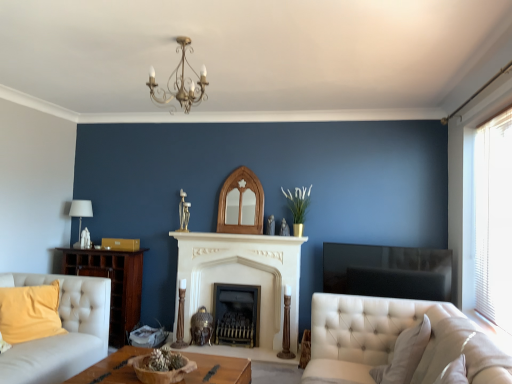
Question: Is white fabric lampshade at left not near gold metallic chandelier at upper center?

Choices:
 (A) yes
 (B) no

Answer: (A)

Question: Considering the relative sizes of white fabric lampshade at left and gold metallic chandelier at upper center in the image provided, is white fabric lampshade at left taller than gold metallic chandelier at upper center?

Choices:
 (A) yes
 (B) no

Answer: (A)

Question: From a real-world perspective, is white fabric lampshade at left positioned under gold metallic chandelier at upper center based on gravity?

Choices:
 (A) no
 (B) yes

Answer: (B)

Question: Is white fabric lampshade at left touching gold metallic chandelier at upper center?

Choices:
 (A) yes
 (B) no

Answer: (B)

Question: Does white fabric lampshade at left have a smaller size compared to gold metallic chandelier at upper center?

Choices:
 (A) no
 (B) yes

Answer: (B)

Question: Can you confirm if white fabric lampshade at left is bigger than gold metallic chandelier at upper center?

Choices:
 (A) no
 (B) yes

Answer: (A)

Question: Is the depth of white marble fireplace at center less than that of gold metallic chandelier at upper center?

Choices:
 (A) yes
 (B) no

Answer: (B)

Question: Can you confirm if white marble fireplace at center is wider than gold metallic chandelier at upper center?

Choices:
 (A) no
 (B) yes

Answer: (A)

Question: Is gold metallic chandelier at upper center located within white marble fireplace at center?

Choices:
 (A) yes
 (B) no

Answer: (B)

Question: From the image's perspective, is white marble fireplace at center on gold metallic chandelier at upper center?

Choices:
 (A) yes
 (B) no

Answer: (B)

Question: From a real-world perspective, is white marble fireplace at center physically below gold metallic chandelier at upper center?

Choices:
 (A) no
 (B) yes

Answer: (B)

Question: Is white marble fireplace at center touching gold metallic chandelier at upper center?

Choices:
 (A) no
 (B) yes

Answer: (A)

Question: Would you say white fabric lampshade at left is outside wooden bowl at center?

Choices:
 (A) no
 (B) yes

Answer: (B)